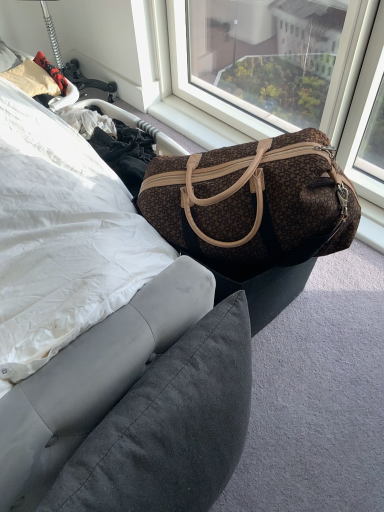
What do you see at coordinates (170, 426) in the screenshot? I see `dark gray fabric sleeping bag at lower right` at bounding box center [170, 426].

Where is `dark gray fabric sleeping bag at lower right`? The image size is (384, 512). dark gray fabric sleeping bag at lower right is located at coordinates (170, 426).

Find the location of a particular element. Image resolution: width=384 pixels, height=512 pixels. dark gray fabric sleeping bag at lower right is located at coordinates (170, 426).